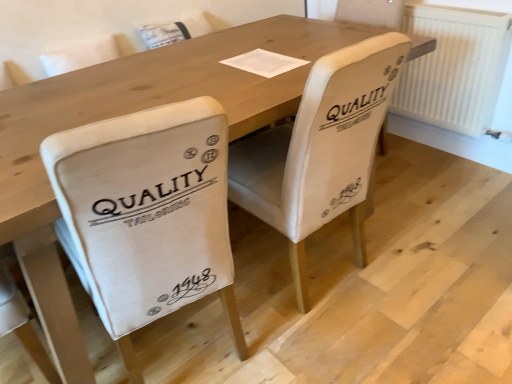
Question: Can you confirm if white paper at center is bigger than white fabric chair at center, the 1th chair when ordered from right to left?

Choices:
 (A) yes
 (B) no

Answer: (B)

Question: Is white paper at center placed right next to white fabric chair at center, the 1th chair when ordered from right to left?

Choices:
 (A) yes
 (B) no

Answer: (B)

Question: From a real-world perspective, is white paper at center positioned over white fabric chair at center, which ranks as the 2th chair in left-to-right order, based on gravity?

Choices:
 (A) yes
 (B) no

Answer: (A)

Question: Is white paper at center positioned far away from white fabric chair at center, which ranks as the 2th chair in left-to-right order?

Choices:
 (A) yes
 (B) no

Answer: (B)

Question: Could white fabric chair at center, which ranks as the 2th chair in left-to-right order, be considered to be inside white paper at center?

Choices:
 (A) no
 (B) yes

Answer: (A)

Question: Is white paper at center shorter than white fabric chair at center, the 1th chair when ordered from right to left?

Choices:
 (A) no
 (B) yes

Answer: (B)

Question: Is white textured radiator at right outside of white fabric chair at center, which ranks as the 2th chair in left-to-right order?

Choices:
 (A) yes
 (B) no

Answer: (A)

Question: Is white textured radiator at right in contact with white fabric chair at center, the 1th chair when ordered from right to left?

Choices:
 (A) yes
 (B) no

Answer: (B)

Question: Is white textured radiator at right far away from white fabric chair at center, which ranks as the 2th chair in left-to-right order?

Choices:
 (A) yes
 (B) no

Answer: (A)

Question: Is white textured radiator at right surrounding white fabric chair at center, the 1th chair when ordered from right to left?

Choices:
 (A) yes
 (B) no

Answer: (B)

Question: From a real-world perspective, is white textured radiator at right physically above white fabric chair at center, the 1th chair when ordered from right to left?

Choices:
 (A) yes
 (B) no

Answer: (B)

Question: Considering the relative sizes of white textured radiator at right and white fabric chair at center, which ranks as the 2th chair in left-to-right order, in the image provided, is white textured radiator at right shorter than white fabric chair at center, which ranks as the 2th chair in left-to-right order,?

Choices:
 (A) yes
 (B) no

Answer: (A)

Question: Does white fabric chair at center, which ranks as the 2th chair in left-to-right order, have a larger size compared to beige fabric chair at center, which appears as the 2th chair when viewed from the right?

Choices:
 (A) yes
 (B) no

Answer: (B)